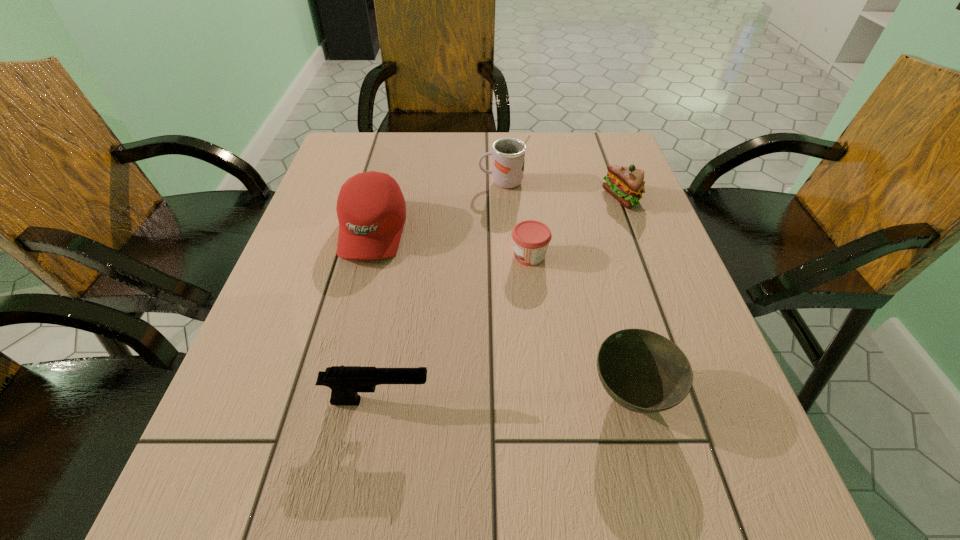
The image size is (960, 540). I want to click on free spot between the bowl and the tallest object, so pyautogui.click(x=566, y=288).

Find the location of a particular element. free space between the tallest object and the sandwich is located at coordinates (563, 191).

Find the location of a particular element. The width and height of the screenshot is (960, 540). free space that is in between the cup and the sandwich is located at coordinates (563, 191).

At what (x,y) coordinates should I click in order to perform the action: click on free point between the sandwich and the bowl. Please return your answer as a coordinate pair (x, y). This screenshot has height=540, width=960. Looking at the image, I should click on (627, 296).

The image size is (960, 540). What are the coordinates of `unoccupied position between the tallest object and the sandwich` in the screenshot? It's located at (563, 191).

The height and width of the screenshot is (540, 960). In order to click on free space between the shortest object and the pistol in this screenshot , I will do `click(454, 328)`.

In order to click on vacant area that lies between the shortest object and the cap in this screenshot , I will do `click(451, 244)`.

Select which object appears as the closest to the tallest object. Please provide its 2D coordinates. Your answer should be formatted as a tuple, i.e. [(x, y)], where the tuple contains the x and y coordinates of a point satisfying the conditions above.

[(371, 210)]

Identify which object is the second closest to the sandwich. Please provide its 2D coordinates. Your answer should be formatted as a tuple, i.e. [(x, y)], where the tuple contains the x and y coordinates of a point satisfying the conditions above.

[(531, 238)]

Where is `vacant point that satisfies the following two spatial constraints: 1. on the front label of the shortest object; 2. on the back side of the bowl`? The height and width of the screenshot is (540, 960). vacant point that satisfies the following two spatial constraints: 1. on the front label of the shortest object; 2. on the back side of the bowl is located at coordinates (545, 395).